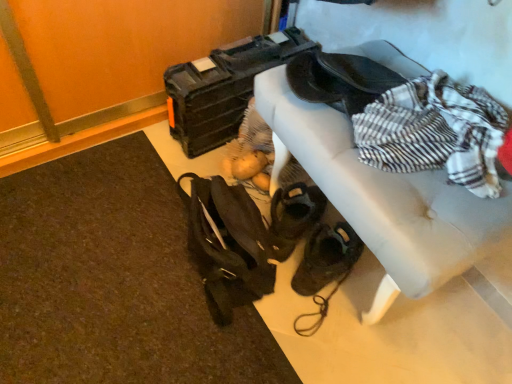
Question: Considering the positions of leather couch at upper right and matte black toolbox at upper center in the image, is leather couch at upper right wider or thinner than matte black toolbox at upper center?

Choices:
 (A) thin
 (B) wide

Answer: (A)

Question: From the image's perspective, is leather couch at upper right located above or below matte black toolbox at upper center?

Choices:
 (A) below
 (B) above

Answer: (A)

Question: Based on their relative distances, which object is farther from the matte black toolbox at upper center?

Choices:
 (A) leather couch at upper right
 (B) dark brown leather messenger bag at lower center

Answer: (B)

Question: Which object is the farthest from the matte black toolbox at upper center?

Choices:
 (A) dark brown leather messenger bag at lower center
 (B) leather couch at upper right

Answer: (A)